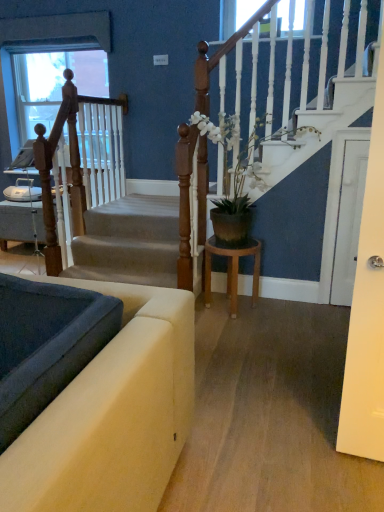
Image resolution: width=384 pixels, height=512 pixels. Identify the location of free space in front of wooden stool at center. (238, 330).